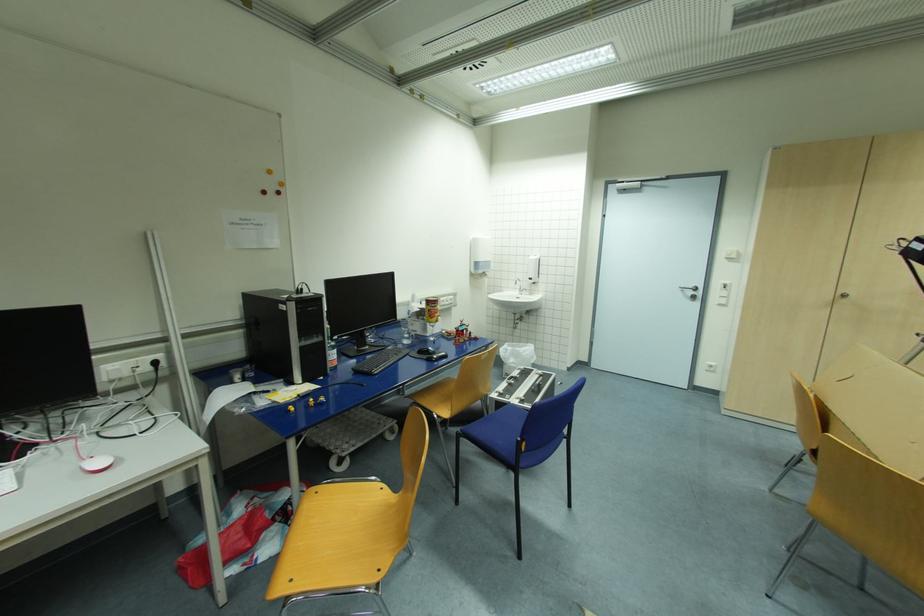
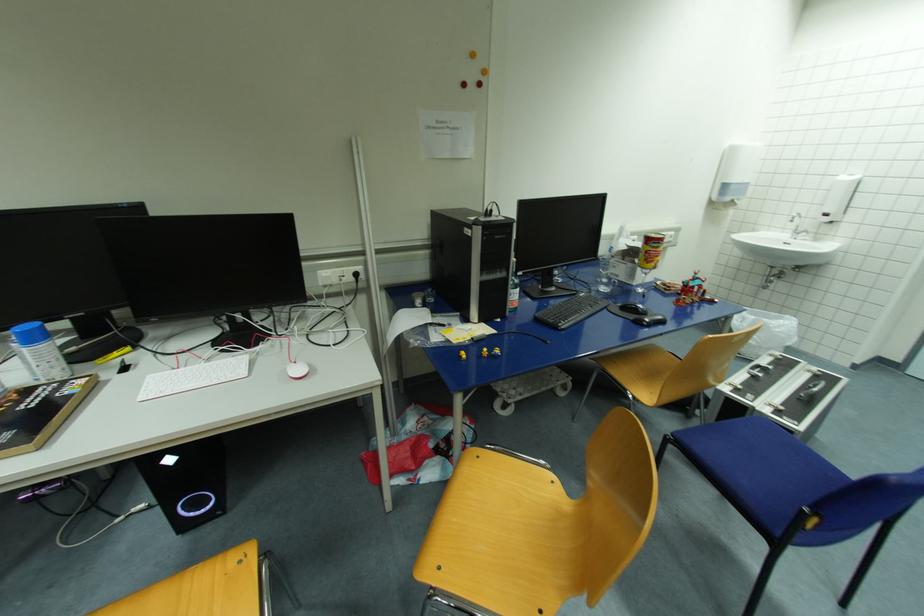
Where in the second image is the point corresponding to [408,342] from the first image?

(605, 290)